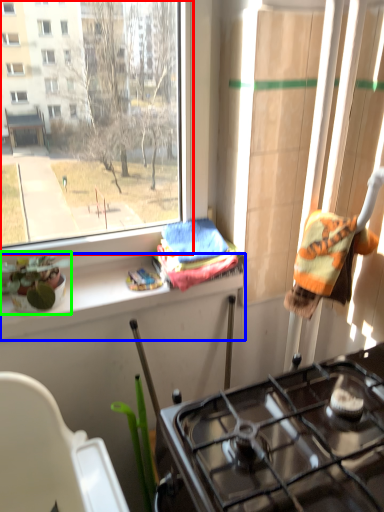
Question: Estimate the real-world distances between objects in this image. Which object is closer to window (highlighted by a red box), ledge (highlighted by a blue box) or houseplant (highlighted by a green box)?

Choices:
 (A) ledge
 (B) houseplant

Answer: (B)